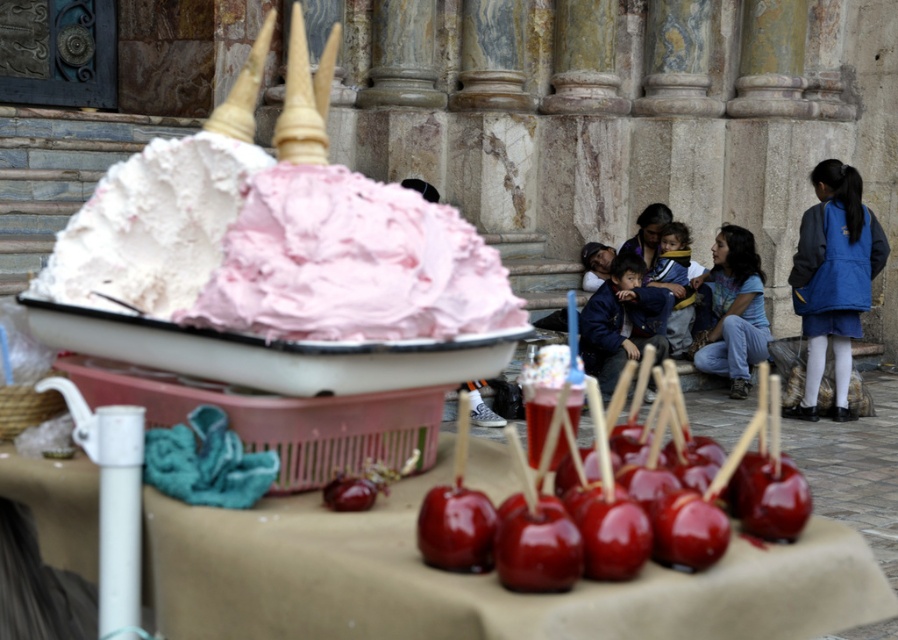
You are standing at the edge of the table looking at the treats. There are two points marked on the table surface. The first point is at coordinates point (227, 166) and the second point is at point (711, 358). Which point is closer to you?

Point (227, 166) is in front of point (711, 358), so it is closer to you.

You are at a fair and see the pink fluffy frosting at center and the blue denim jeans at lower right. Which item is positioned to the left?

The pink fluffy frosting at center is positioned to the left of the blue denim jeans at lower right.